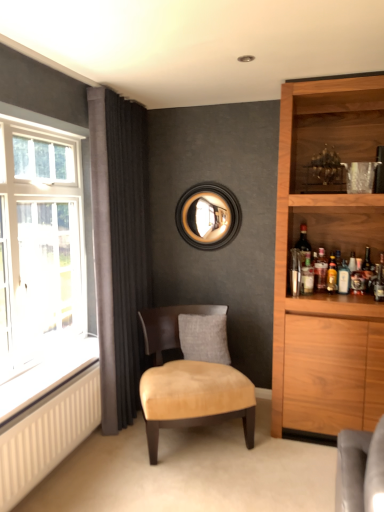
Question: Considering the positions of point (365, 284) and point (115, 359), is point (365, 284) closer or farther from the camera than point (115, 359)?

Choices:
 (A) closer
 (B) farther

Answer: (B)

Question: Considering the relative positions of shiny dark glass bottle at right, arranged as the 3th bottle when viewed from the left, and dark grey velvet curtains at left in the image provided, is shiny dark glass bottle at right, arranged as the 3th bottle when viewed from the left, to the left or to the right of dark grey velvet curtains at left?

Choices:
 (A) right
 (B) left

Answer: (A)

Question: Which object is positioned closest to the translucent glass bottle at right, positioned as the 3th bottle in right-to-left order?

Choices:
 (A) clear glass bottle at right
 (B) dark grey velvet curtains at left
 (C) gray fabric pillow at center
 (D) matte dark brown wine bottle at right
 (E) shiny dark glass bottle at right, the 1th bottle positioned from the right

Answer: (D)

Question: Which object is the farthest from the clear glass window at left?

Choices:
 (A) dark grey velvet curtains at left
 (B) shiny dark glass bottle at right, the 1th bottle positioned from the right
 (C) matte dark brown wine bottle at right
 (D) translucent glass bottle at right, the 1th bottle in the left-to-right sequence
 (E) black wood mirror at upper center

Answer: (B)